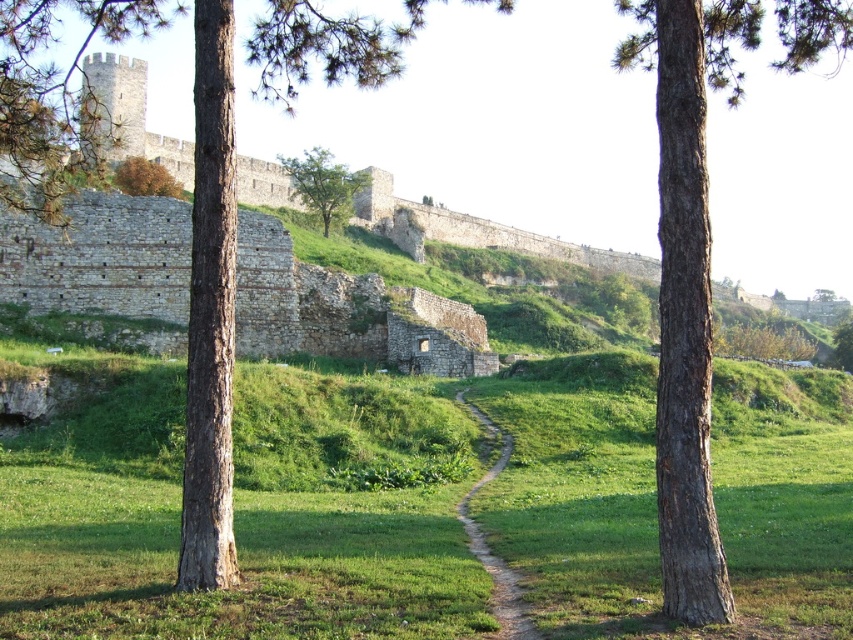
Question: Estimate the real-world distances between objects in this image. Which object is farther from the brown rough bark tree at center?

Choices:
 (A) dirt path at center
 (B) brown textured tree at upper left
 (C) green grassy at center

Answer: (B)

Question: Can you confirm if brown rough bark tree at center is positioned above brown textured tree at upper left?

Choices:
 (A) yes
 (B) no

Answer: (A)

Question: Does brown rough bark tree at center appear under dirt path at center?

Choices:
 (A) yes
 (B) no

Answer: (B)

Question: Which of the following is the farthest from the observer?

Choices:
 (A) dirt path at center
 (B) green leafy tree at center

Answer: (B)

Question: Can you confirm if brown rough bark tree at center is positioned above green leafy tree at center?

Choices:
 (A) yes
 (B) no

Answer: (B)

Question: Which object is the closest to the green leafy tree at center?

Choices:
 (A) brown textured tree at upper left
 (B) brown rough bark tree at center
 (C) dirt path at center

Answer: (A)